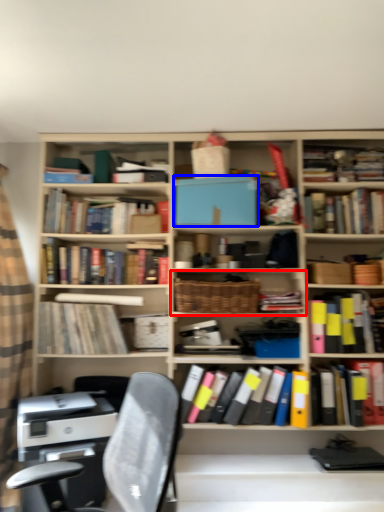
Question: Among these objects, which one is nearest to the camera, shelf (highlighted by a red box) or paperback book (highlighted by a blue box)?

Choices:
 (A) shelf
 (B) paperback book

Answer: (A)